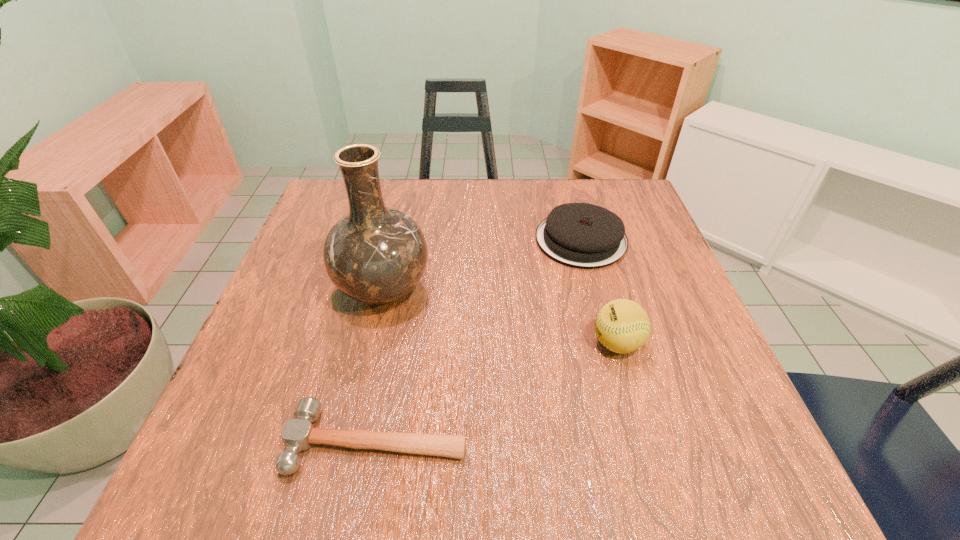
Locate an element on the screen. free space between the third tallest object and the hammer is located at coordinates (479, 341).

The height and width of the screenshot is (540, 960). I want to click on free space between the vase and the shortest object, so click(x=380, y=366).

The height and width of the screenshot is (540, 960). In order to click on blank region between the softball and the second shortest object in this screenshot , I will do `click(599, 292)`.

Where is `free space between the second shortest object and the softball`? Image resolution: width=960 pixels, height=540 pixels. free space between the second shortest object and the softball is located at coordinates (599, 292).

Select which object appears as the third closest to the vase. Please provide its 2D coordinates. Your answer should be formatted as a tuple, i.e. [(x, y)], where the tuple contains the x and y coordinates of a point satisfying the conditions above.

[(622, 326)]

Identify which object is the second closest to the vase. Please provide its 2D coordinates. Your answer should be formatted as a tuple, i.e. [(x, y)], where the tuple contains the x and y coordinates of a point satisfying the conditions above.

[(581, 235)]

You are a GUI agent. You are given a task and a screenshot of the screen. Output one action in this format:
    pyautogui.click(x=<x>, y=<y>)
    Task: Click on the vacant space that satisfies the following two spatial constraints: 1. on the front side of the shortest object; 2. on the left side of the vase
    
    Given the screenshot: What is the action you would take?
    pyautogui.click(x=349, y=441)

Identify the location of free point that satisfies the following two spatial constraints: 1. on the front side of the tallest object; 2. on the left side of the shortest object. (349, 441).